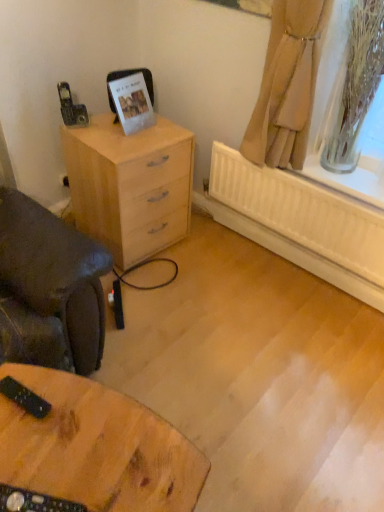
Question: Would you say beige fabric curtain at upper right is to the left or to the right of wooden table at lower left in the picture?

Choices:
 (A) left
 (B) right

Answer: (B)

Question: From the image's perspective, is beige fabric curtain at upper right above or below wooden table at lower left?

Choices:
 (A) above
 (B) below

Answer: (A)

Question: Which of these objects is positioned closest to the light wood chest of drawers at left?

Choices:
 (A) wooden table at lower left
 (B) beige fabric curtain at upper right

Answer: (B)

Question: Based on their relative distances, which object is farther from the beige fabric curtain at upper right?

Choices:
 (A) wooden table at lower left
 (B) light wood chest of drawers at left

Answer: (A)